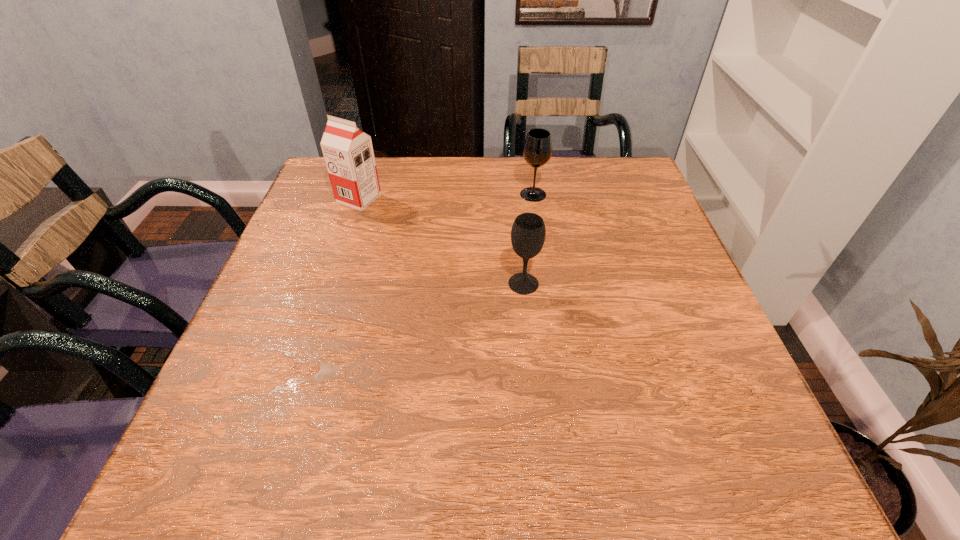
At what (x,y) coordinates should I click in order to perform the action: click on the tallest object. Please return your answer as a coordinate pair (x, y). Looking at the image, I should click on (348, 152).

Identify the location of the leftmost object. This screenshot has width=960, height=540. (348, 152).

Locate an element on the screen. Image resolution: width=960 pixels, height=540 pixels. the farther wineglass is located at coordinates [x=537, y=150].

At what (x,y) coordinates should I click in order to perform the action: click on the nearest object. Please return your answer as a coordinate pair (x, y). This screenshot has height=540, width=960. Looking at the image, I should click on (528, 232).

Where is `vacant space located on the front of the soya milk`? This screenshot has height=540, width=960. vacant space located on the front of the soya milk is located at coordinates (317, 324).

Where is `blank space located on the left of the farther wineglass`? Image resolution: width=960 pixels, height=540 pixels. blank space located on the left of the farther wineglass is located at coordinates (468, 194).

I want to click on free point located on the back of the nearer wineglass, so click(x=521, y=258).

This screenshot has height=540, width=960. What are the coordinates of `soya milk that is positioned at the far edge` in the screenshot? It's located at (348, 152).

Where is `wineglass at the far edge`? This screenshot has height=540, width=960. wineglass at the far edge is located at coordinates (537, 150).

This screenshot has height=540, width=960. Find the location of `object that is at the left edge`. object that is at the left edge is located at coordinates pos(348,152).